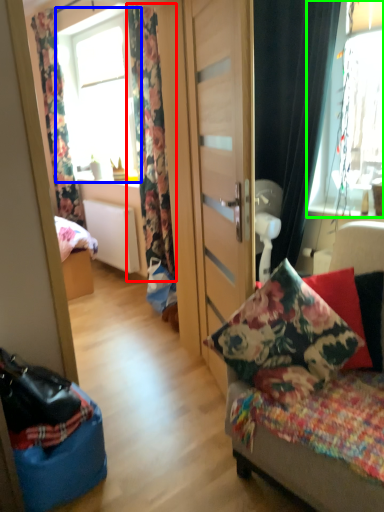
Question: Which object is positioned farthest from curtain (highlighted by a red box)? Select from window (highlighted by a blue box) and window (highlighted by a green box).

Choices:
 (A) window
 (B) window

Answer: (A)